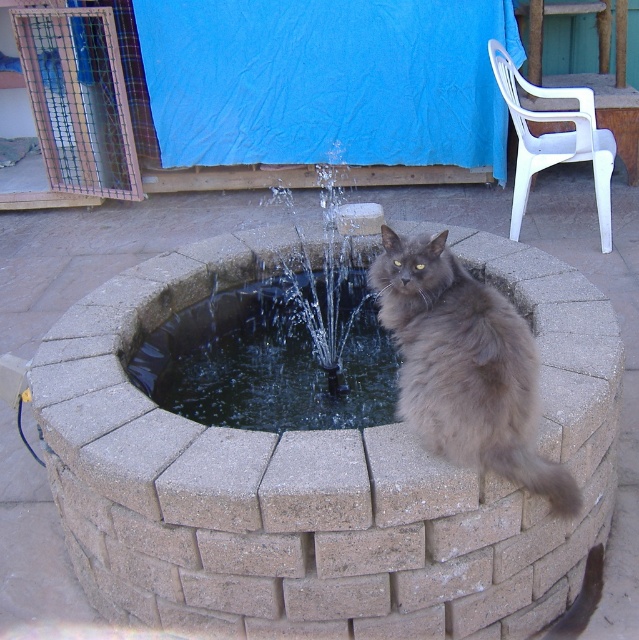
Between brown brick fountain at center and gray fluffy cat at upper center, which one is positioned higher?

Positioned higher is brown brick fountain at center.

Can you confirm if brown brick fountain at center is bigger than gray fluffy cat at upper center?

Yes.

Does point (466, 252) come closer to viewer compared to point (396, 246)?

That is False.

Identify the location of brown brick fountain at center. Image resolution: width=639 pixels, height=640 pixels. (544, 260).

Does brown brick fountain at center lie in front of clear water at fountain center?

No.

Is brown brick fountain at center taller than clear water at fountain center?

Correct, brown brick fountain at center is much taller as clear water at fountain center.

What do you see at coordinates (544, 260) in the screenshot? The image size is (639, 640). I see `brown brick fountain at center` at bounding box center [544, 260].

Where is `brown brick fountain at center`? brown brick fountain at center is located at coordinates (544, 260).

From the picture: Does clear water at fountain center have a lesser width compared to gray fluffy cat at upper center?

Incorrect, clear water at fountain center's width is not less than gray fluffy cat at upper center's.

Does clear water at fountain center have a greater height compared to gray fluffy cat at upper center?

No.

Is point (282, 316) positioned behind point (413, 353)?

Yes.

This screenshot has width=639, height=640. Identify the location of clear water at fountain center. (275, 355).